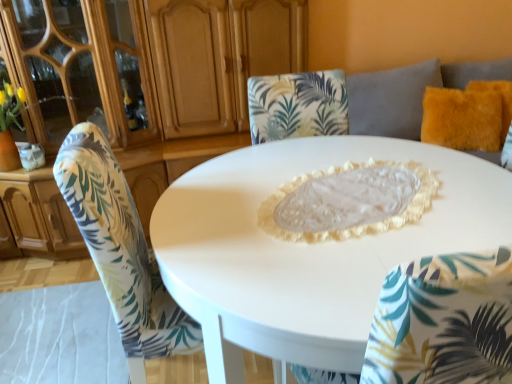
Question: From the image's perspective, is fuzzy orange pillow at upper right positioned above or below matte wood dresser at upper left?

Choices:
 (A) below
 (B) above

Answer: (B)

Question: From a real-world perspective, is fuzzy orange pillow at upper right above or below matte wood dresser at upper left?

Choices:
 (A) below
 (B) above

Answer: (A)

Question: Which object is the closest to the fuzzy orange pillow at upper right?

Choices:
 (A) white glossy table at center
 (B) matte wood dresser at upper left
 (C) printed fabric chair at center

Answer: (A)

Question: Which object is positioned closest to the white glossy table at center?

Choices:
 (A) printed fabric chair at center
 (B) fuzzy orange pillow at upper right
 (C) matte wood dresser at upper left

Answer: (A)